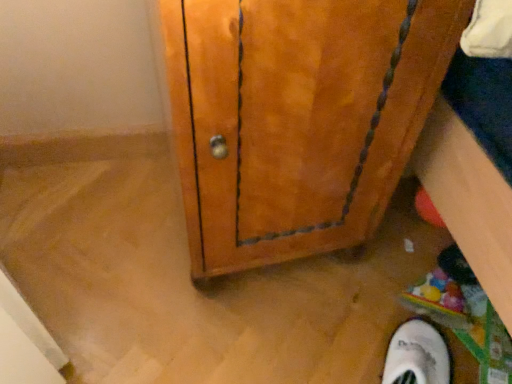
What do you see at coordinates (417, 355) in the screenshot? This screenshot has width=512, height=384. I see `white suede shoe at lower right` at bounding box center [417, 355].

At what (x,y) coordinates should I click in order to perform the action: click on white suede shoe at lower right. Please return your answer as a coordinate pair (x, y). Looking at the image, I should click on (417, 355).

Image resolution: width=512 pixels, height=384 pixels. What do you see at coordinates (297, 117) in the screenshot? I see `wooden cabinet at center` at bounding box center [297, 117].

What is the approximate width of wooden cabinet at center?

19.58 inches.

Locate an element on the screen. wooden cabinet at center is located at coordinates (297, 117).

Measure the distance between wooden cabinet at center and camera.

They are 15.18 inches apart.

Where is `white suede shoe at lower right`? white suede shoe at lower right is located at coordinates (417, 355).

Is white suede shoe at lower right to the right of wooden cabinet at center from the viewer's perspective?

Correct, you'll find white suede shoe at lower right to the right of wooden cabinet at center.

Which is behind, white suede shoe at lower right or wooden cabinet at center?

white suede shoe at lower right.

Is point (441, 352) more distant than point (226, 138)?

Yes, point (441, 352) is behind point (226, 138).

From the image's perspective, is white suede shoe at lower right located beneath wooden cabinet at center?

Correct, white suede shoe at lower right appears lower than wooden cabinet at center in the image.

From a real-world perspective, who is located lower, white suede shoe at lower right or wooden cabinet at center?

In real-world perspective, white suede shoe at lower right is lower.

Can you confirm if white suede shoe at lower right is thinner than wooden cabinet at center?

Yes, white suede shoe at lower right is thinner than wooden cabinet at center.

Who is shorter, white suede shoe at lower right or wooden cabinet at center?

white suede shoe at lower right is shorter.

Considering the sizes of objects white suede shoe at lower right and wooden cabinet at center in the image provided, who is smaller, white suede shoe at lower right or wooden cabinet at center?

white suede shoe at lower right is smaller.

Is wooden cabinet at center a part of white suede shoe at lower right?

No.

Is there a large distance between white suede shoe at lower right and wooden cabinet at center?

That's not correct — white suede shoe at lower right is a little close to wooden cabinet at center.

Is white suede shoe at lower right facing away from wooden cabinet at center?

No, white suede shoe at lower right is not facing the opposite direction of wooden cabinet at center.

Where is `door above the white suede shoe at lower right (from a real-world perspective)`? door above the white suede shoe at lower right (from a real-world perspective) is located at coordinates (297, 117).

Is wooden cabinet at center at the right side of white suede shoe at lower right?

No, wooden cabinet at center is not to the right of white suede shoe at lower right.

Between wooden cabinet at center and white suede shoe at lower right, which one is positioned behind?

white suede shoe at lower right is behind.

Considering the positions of points (285, 188) and (405, 338), is point (285, 188) farther from camera compared to point (405, 338)?

That is False.

From the image's perspective, is wooden cabinet at center above or below white suede shoe at lower right?

Based on their image positions, wooden cabinet at center is located above white suede shoe at lower right.

From a real-world perspective, is wooden cabinet at center over white suede shoe at lower right?

Correct, in the physical world, wooden cabinet at center is higher than white suede shoe at lower right.

Considering the relative sizes of wooden cabinet at center and white suede shoe at lower right in the image provided, is wooden cabinet at center thinner than white suede shoe at lower right?

No.

In terms of height, does wooden cabinet at center look taller or shorter compared to white suede shoe at lower right?

wooden cabinet at center is taller than white suede shoe at lower right.

Between wooden cabinet at center and white suede shoe at lower right, which one has larger size?

wooden cabinet at center is bigger.

Is white suede shoe at lower right surrounded by wooden cabinet at center?

No, white suede shoe at lower right is not inside wooden cabinet at center.

Is wooden cabinet at center touching white suede shoe at lower right?

No.

Looking at this image, does wooden cabinet at center turn towards white suede shoe at lower right?

Yes.

Locate an element on the screen. door on the left of white suede shoe at lower right is located at coordinates (297, 117).

Locate an element on the screen. The image size is (512, 384). door in front of the white suede shoe at lower right is located at coordinates (297, 117).

At what (x,y) coordinates should I click in order to perform the action: click on footwear on the right of wooden cabinet at center. Please return your answer as a coordinate pair (x, y). This screenshot has width=512, height=384. Looking at the image, I should click on (417, 355).